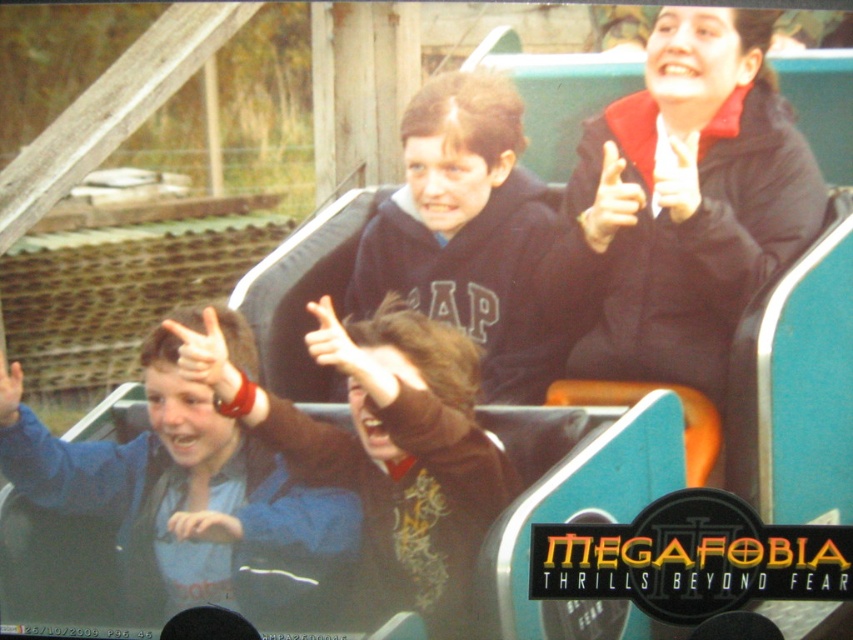
Between black matte jacket at upper right and brown fuzzy sweater at center, which one is positioned lower?

Positioned lower is brown fuzzy sweater at center.

Can you confirm if black matte jacket at upper right is bigger than brown fuzzy sweater at center?

No, black matte jacket at upper right is not bigger than brown fuzzy sweater at center.

Is point (720, 196) in front of point (325, 348)?

Yes, point (720, 196) is closer to viewer.

The height and width of the screenshot is (640, 853). What are the coordinates of `black matte jacket at upper right` in the screenshot? It's located at [695, 198].

Who is positioned more to the left, black matte jacket at upper right or dark blue hoodie at center?

From the viewer's perspective, dark blue hoodie at center appears more on the left side.

Describe the element at coordinates (695, 198) in the screenshot. I see `black matte jacket at upper right` at that location.

Where is `black matte jacket at upper right`? Image resolution: width=853 pixels, height=640 pixels. black matte jacket at upper right is located at coordinates (695, 198).

In the scene shown: Who is more forward, (120, 584) or (442, 179)?

Point (442, 179) is in front.

Which of these two, blue fleece jacket at lower left or dark blue hoodie at center, stands taller?

Standing taller between the two is blue fleece jacket at lower left.

The width and height of the screenshot is (853, 640). In order to click on blue fleece jacket at lower left in this screenshot , I will do `click(183, 499)`.